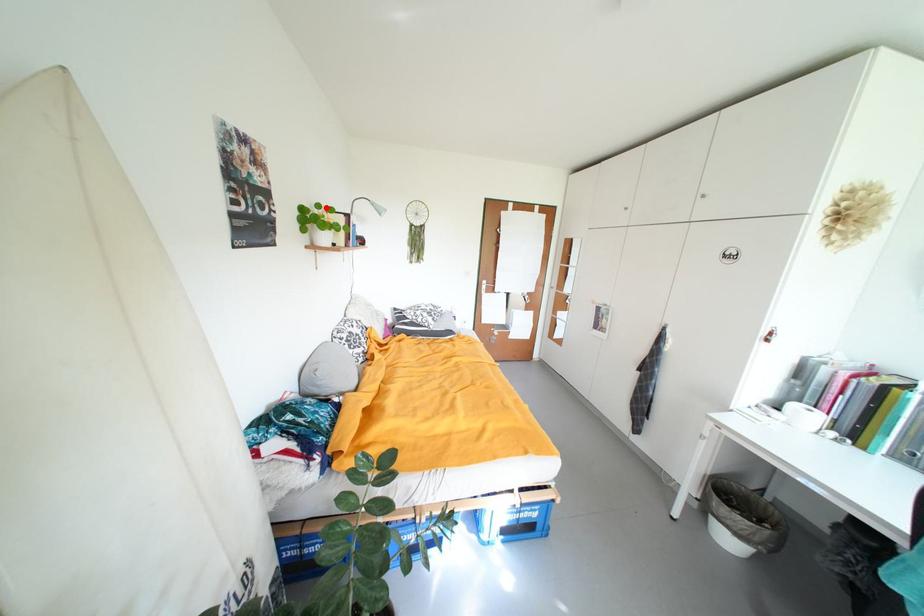
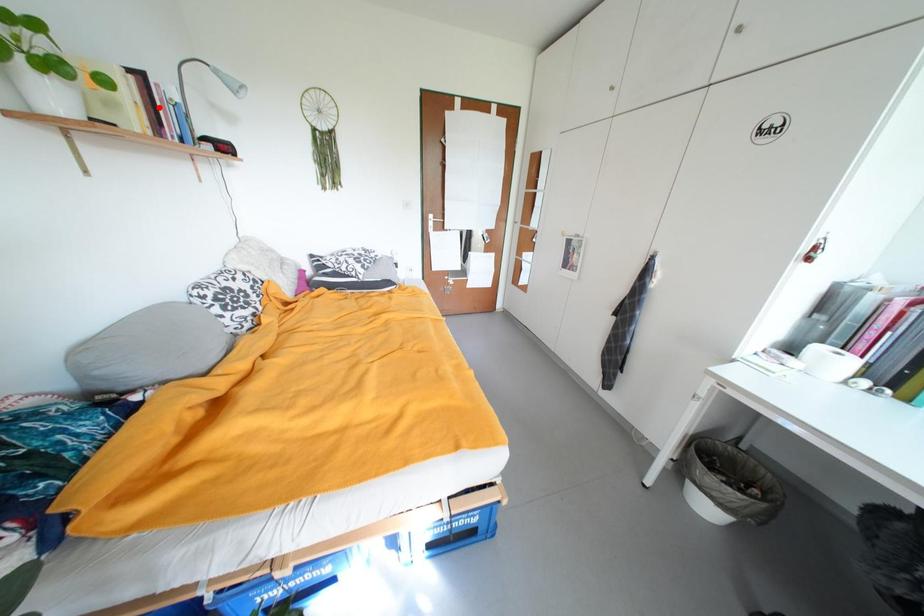
I am providing you with two images of the same scene from different viewpoints. A red point is marked on the first image and another point is marked on the second image. Is the red point in image1 aligned with the point shown in image2?

No